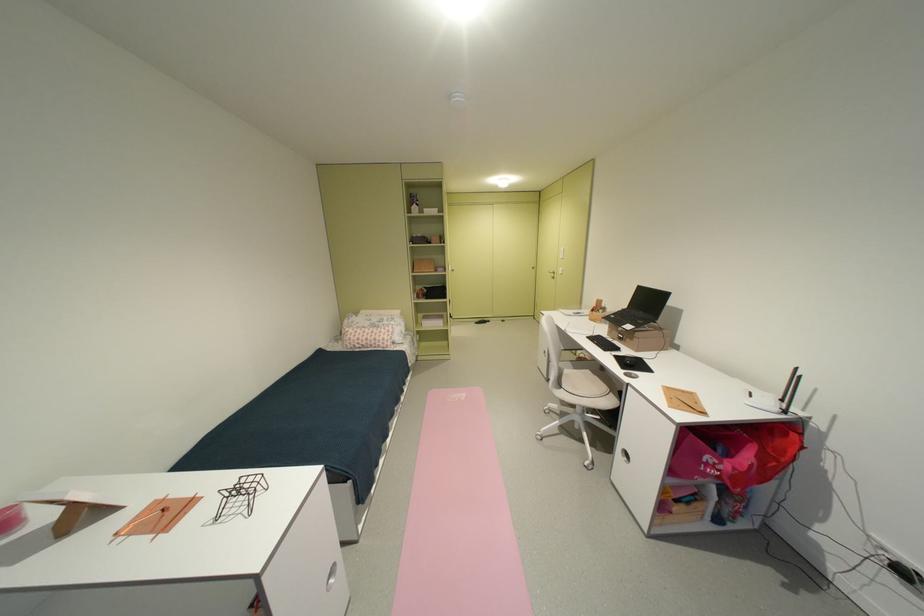
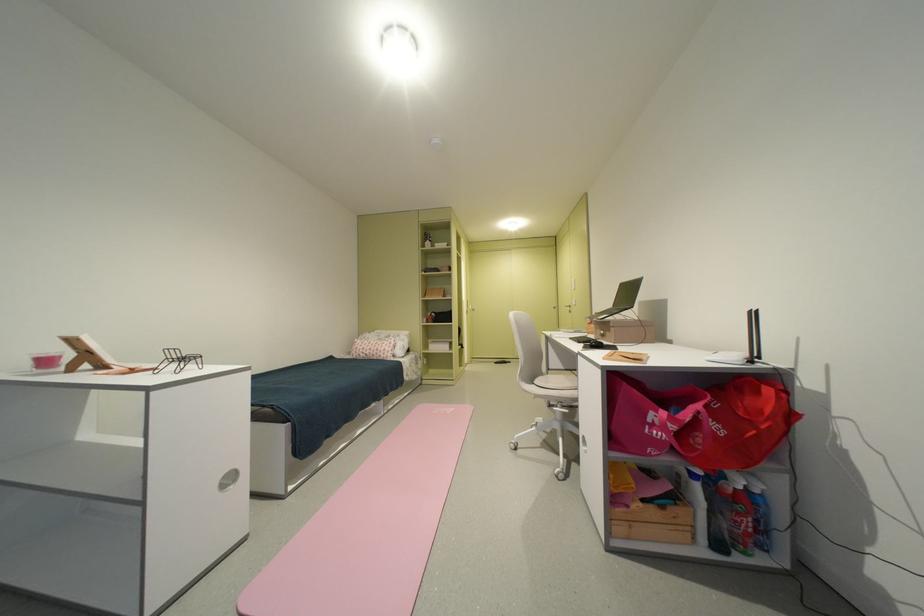
The point at (457,400) is marked in the first image. Where is the corresponding point in the second image?

(444, 413)